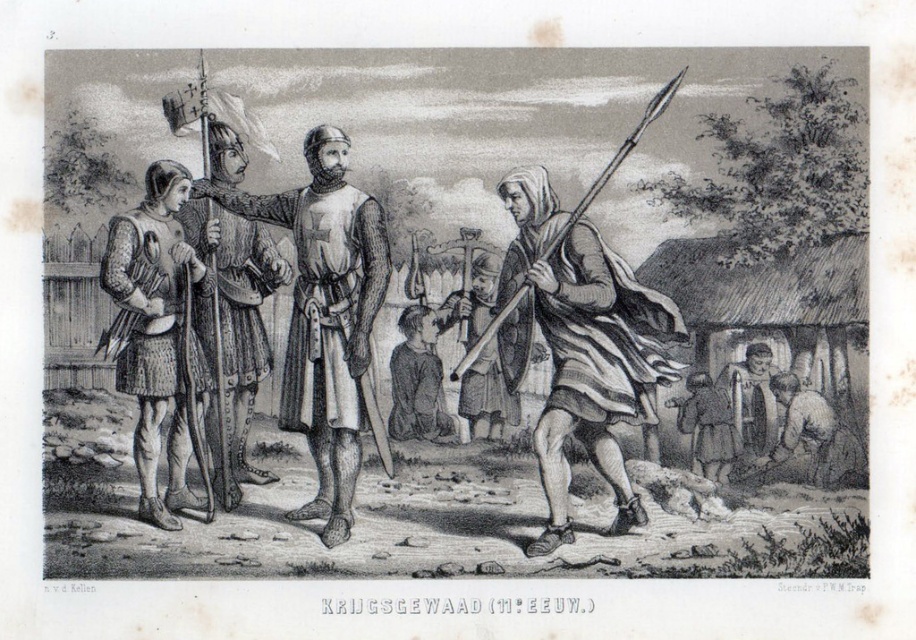
Question: Can you confirm if metallic chainmail armor at center is smaller than brown leather shoes at lower right?

Choices:
 (A) no
 (B) yes

Answer: (A)

Question: Which object is the closest to the dark brown leather shoes at center?

Choices:
 (A) chainmail armor at left
 (B) brown leather bag at lower right
 (C) metallic chainmail armor at center

Answer: (C)

Question: Which object is positioned closest to the wooden staff at center?

Choices:
 (A) dark brown leather shoes at center
 (B) polished steel helmet at center
 (C) striped cloth cape at center

Answer: (A)

Question: Observing the image, what is the correct spatial positioning of metallic chainmail armor at center in reference to dark brown leather shoes at center?

Choices:
 (A) right
 (B) left

Answer: (B)

Question: Is wooden staff at center wider than dark brown leather shoes at center?

Choices:
 (A) no
 (B) yes

Answer: (A)

Question: Estimate the real-world distances between objects in this image. Which object is farther from the brown leather bag at lower right?

Choices:
 (A) striped cloth cape at center
 (B) chainmail armor at left
 (C) dark brown leather shoes at center
 (D) wooden staff at center

Answer: (B)